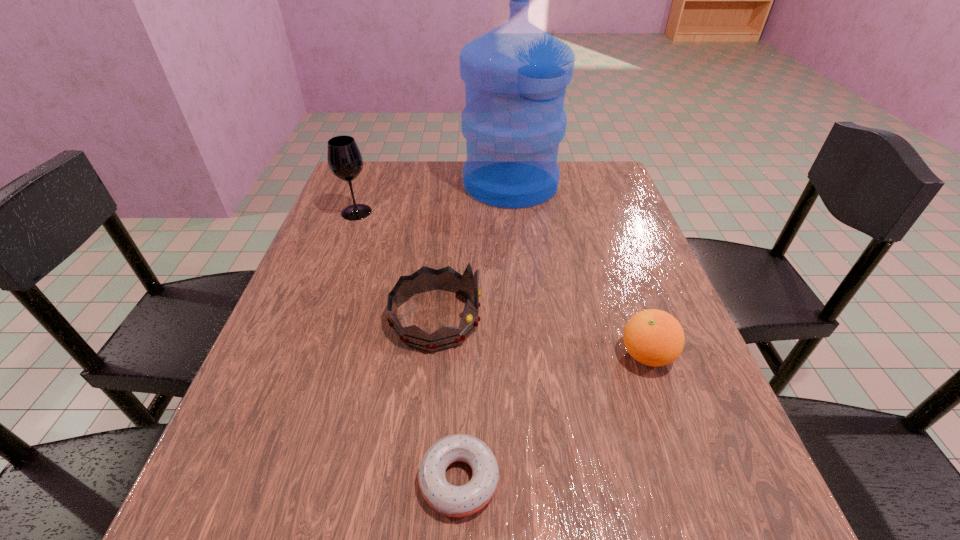
You are a GUI agent. You are given a task and a screenshot of the screen. Output one action in this format:
    pyautogui.click(x=<x>, y=<y>)
    Task: Click on the free space between the third tallest object and the water jug
    This screenshot has height=540, width=960.
    Given the screenshot: What is the action you would take?
    pyautogui.click(x=473, y=251)

Identify the location of object that stands as the second closest to the fourth tallest object. The image size is (960, 540). (454, 501).

Locate an element on the screen. object identified as the second closest to the fourth tallest object is located at coordinates tap(454, 501).

The width and height of the screenshot is (960, 540). In order to click on free spot that satisfies the following two spatial constraints: 1. on the front side of the tallest object; 2. at the front of the tiara with jewels in this screenshot , I will do `click(524, 318)`.

This screenshot has height=540, width=960. Identify the location of free space that satisfies the following two spatial constraints: 1. on the front side of the tallest object; 2. at the front of the tiara with jewels. (524, 318).

Locate an element on the screen. The width and height of the screenshot is (960, 540). free region that satisfies the following two spatial constraints: 1. on the front side of the water jug; 2. on the right side of the orange is located at coordinates (528, 355).

Locate an element on the screen. This screenshot has width=960, height=540. vacant area in the image that satisfies the following two spatial constraints: 1. at the front of the tiara with jewels; 2. on the right side of the fourth tallest object is located at coordinates (432, 355).

Identify the location of blank space that satisfies the following two spatial constraints: 1. at the front of the rightmost object with jewels; 2. on the right side of the third tallest object. The height and width of the screenshot is (540, 960). (432, 355).

This screenshot has height=540, width=960. Identify the location of vacant space that satisfies the following two spatial constraints: 1. at the front of the nearest object with jewels; 2. on the left side of the third tallest object. (420, 480).